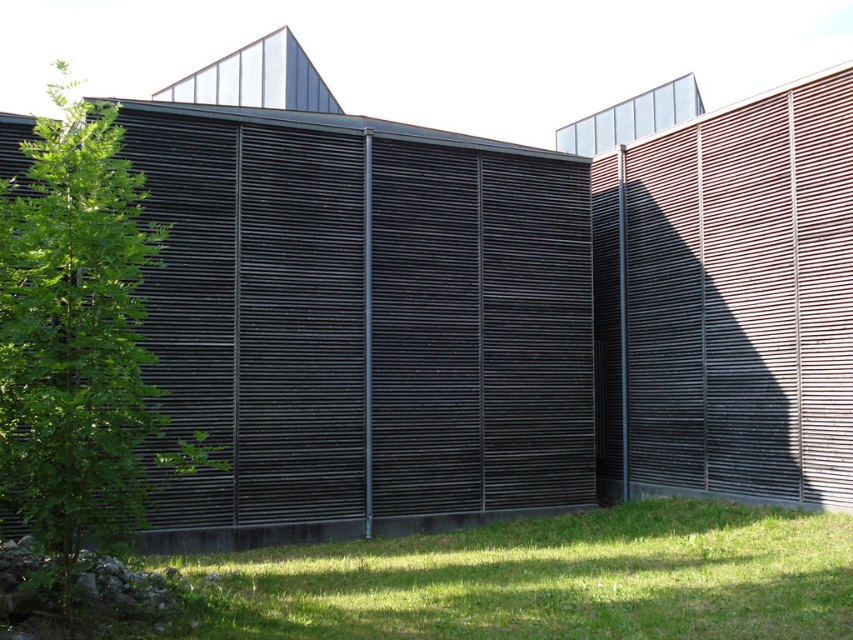
Who is higher up, green grass at lower center or green leafy tree at left?

green leafy tree at left

Which is in front, point (648, 500) or point (73, 556)?

Point (73, 556) is in front.

At what (x,y) coordinates should I click in order to perform the action: click on green grass at lower center. Please return your answer as a coordinate pair (x, y). Looking at the image, I should click on (544, 579).